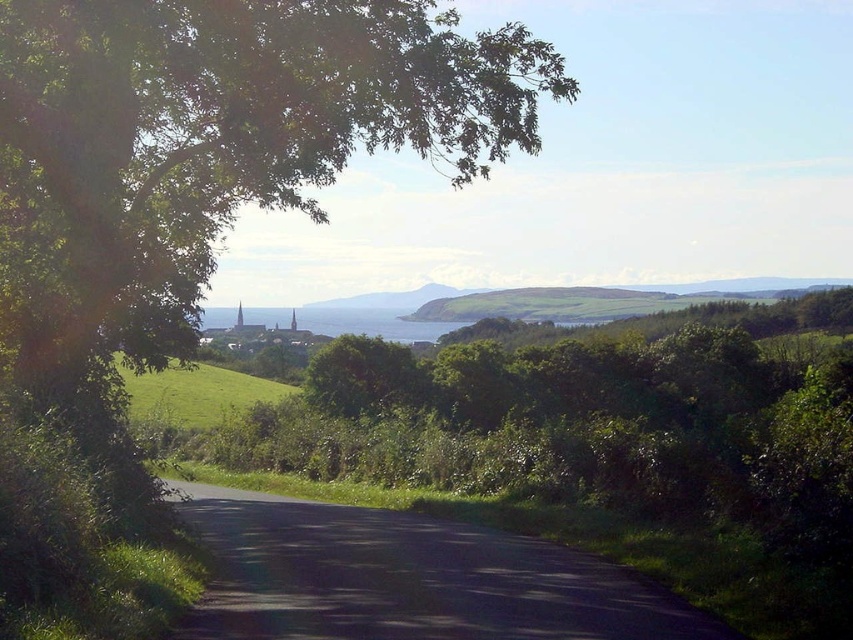
Is point (302, 611) behind point (422, 340)?

No, (302, 611) is in front of (422, 340).

Does black asphalt road at center have a larger size compared to blue water at center?

No, black asphalt road at center is not bigger than blue water at center.

Does point (670, 630) come farther from viewer compared to point (375, 326)?

That is False.

At what (x,y) coordinates should I click in order to perform the action: click on black asphalt road at center. Please return your answer as a coordinate pair (x, y). Looking at the image, I should click on (408, 579).